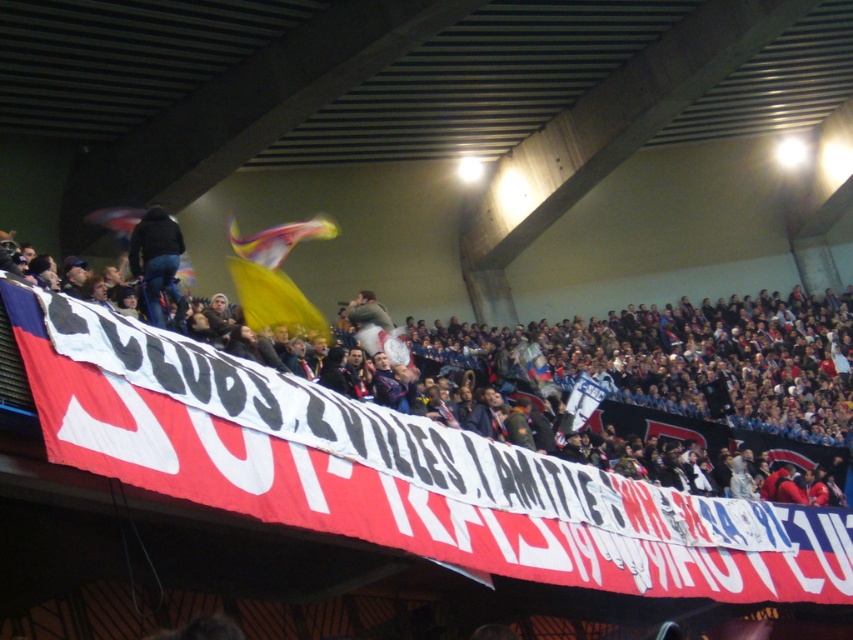
You are a photographer at the stadium trying to capture a photo of the red fabric banner at center and the dark blue jeans at center. Which object should you zoom in on to ensure both are clearly visible in the frame?

The red fabric banner at center is larger in size than dark blue jeans at center, so you should zoom in on the red fabric banner at center to ensure both are clearly visible in the frame.

You are a photographer at the stadium trying to capture the banner. You notice the red fabric banner at center and dark blue jeans at center. Which object is positioned lower in the image?

The red fabric banner at center is below dark blue jeans at center, so the red fabric banner at center is positioned lower in the image.